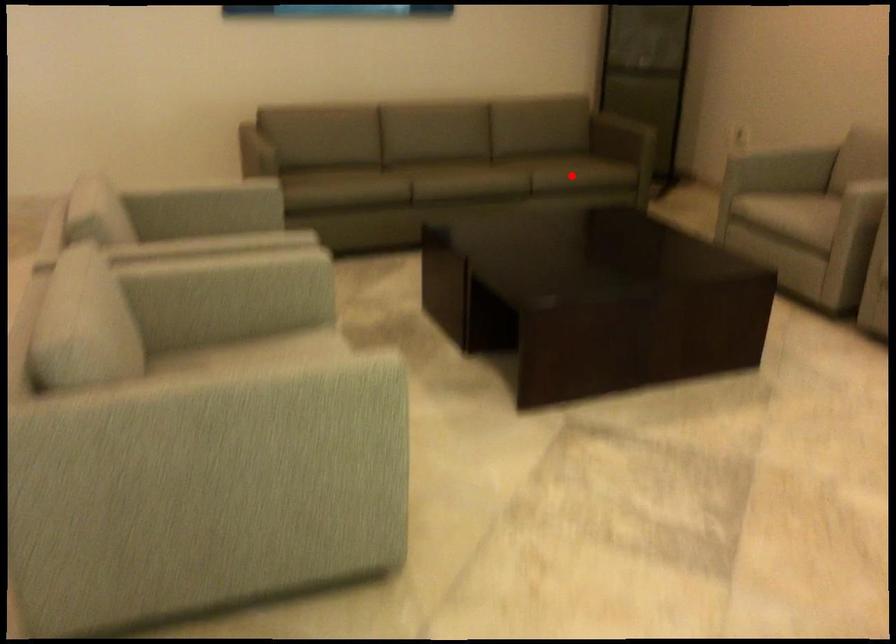
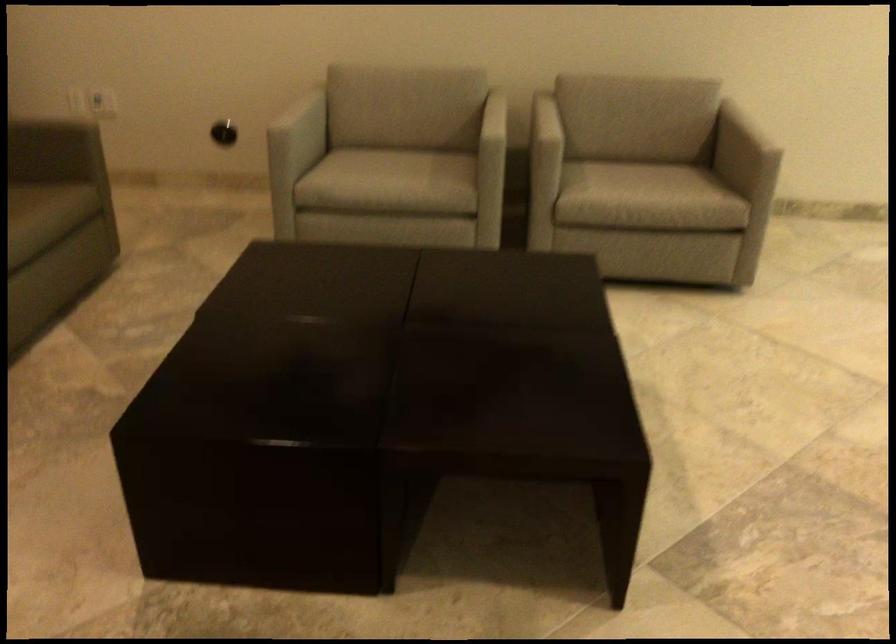
Question: A red point is marked in image1. In image2, is the corresponding 3D point closer to the camera or farther? Reply with the corresponding letter.

Choices:
 (A) The corresponding 3D point is closer.
 (B) The corresponding 3D point is farther.

Answer: (A)